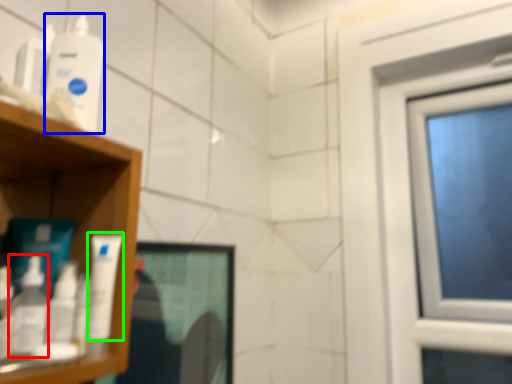
Question: Considering the real-world distances, which object is closest to mouthwash (highlighted by a red box)? mouthwash (highlighted by a blue box) or mouthwash (highlighted by a green box).

Choices:
 (A) mouthwash
 (B) mouthwash

Answer: (B)